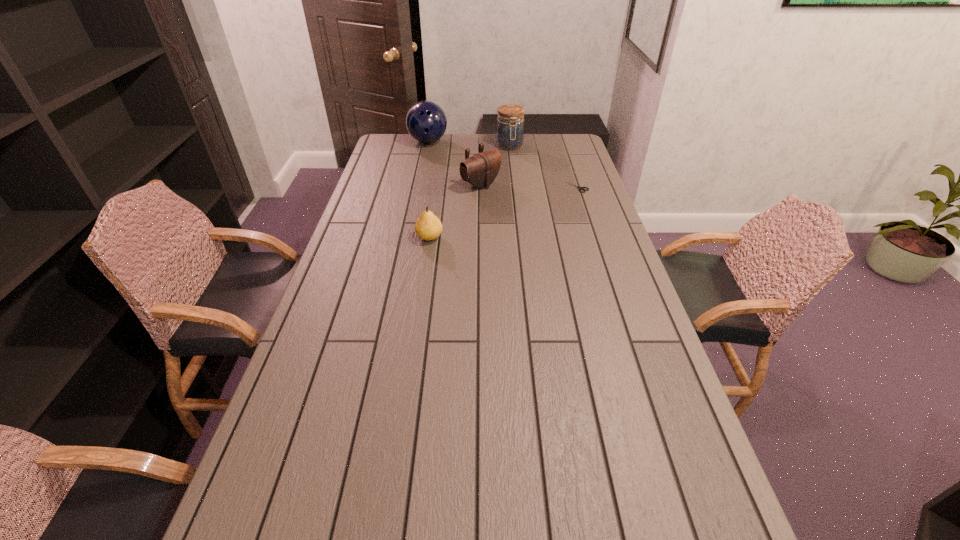
Find the location of a particular element. pear is located at coordinates (428, 226).

This screenshot has height=540, width=960. I want to click on the second shortest object, so click(428, 226).

Locate an element on the screen. The height and width of the screenshot is (540, 960). the shortest object is located at coordinates (580, 188).

This screenshot has width=960, height=540. Find the location of `shears`. shears is located at coordinates (580, 188).

Find the location of `pouch`. pouch is located at coordinates (480, 170).

Image resolution: width=960 pixels, height=540 pixels. Find the location of `bowling ball`. bowling ball is located at coordinates (426, 122).

Where is `jar`? The height and width of the screenshot is (540, 960). jar is located at coordinates (510, 130).

The height and width of the screenshot is (540, 960). What are the coordinates of `free space located on the back of the fourth tallest object` in the screenshot? It's located at (438, 182).

Identify the location of free space located 0.320m on the left of the shears. (486, 186).

Identify the location of free space located 0.240m with the flap open on the pouch. (540, 217).